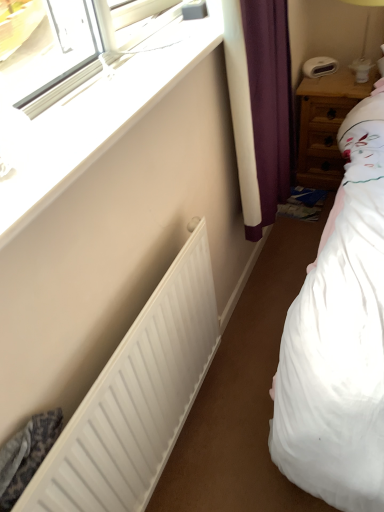
The height and width of the screenshot is (512, 384). Find the location of `white plastic bedside lamp at upper right`. white plastic bedside lamp at upper right is located at coordinates (363, 42).

Image resolution: width=384 pixels, height=512 pixels. Find the location of `white plastic window at upper left`. white plastic window at upper left is located at coordinates (96, 123).

Does white matte radiator at lower left have a larger size compared to white plastic window at upper left?

Yes.

From a real-world perspective, which is physically above, white matte radiator at lower left or white plastic window at upper left?

In real-world perspective, white plastic window at upper left is above.

Is white matte radiator at lower left completely or partially outside of white plastic window at upper left?

That's correct, white matte radiator at lower left is outside of white plastic window at upper left.

Is white matte radiator at lower left positioned far away from white plastic window at upper left?

white matte radiator at lower left is actually quite close to white plastic window at upper left.

Which object is positioned more to the right, wooden nightstand at right or white plastic window at upper left?

wooden nightstand at right.

Between wooden nightstand at right and white plastic window at upper left, which one is positioned in front?

white plastic window at upper left is closer to the camera.

Is wooden nightstand at right directly adjacent to white plastic window at upper left?

No, wooden nightstand at right is not next to white plastic window at upper left.

From a real-world perspective, is wooden nightstand at right positioned over white plastic window at upper left based on gravity?

Incorrect, from a real-world perspective, wooden nightstand at right is lower than white plastic window at upper left.

Based on the photo, from a real-world perspective, between wooden nightstand at right and white matte radiator at lower left, who is vertically lower?

From a 3D spatial view, wooden nightstand at right is below.

In the scene shown: How different are the orientations of wooden nightstand at right and white matte radiator at lower left in degrees?

The angle between the facing direction of wooden nightstand at right and the facing direction of white matte radiator at lower left is 90.3 degrees.

Is wooden nightstand at right turned away from white matte radiator at lower left?

wooden nightstand at right does not have its back to white matte radiator at lower left.

You are a GUI agent. You are given a task and a screenshot of the screen. Output one action in this format:
    pyautogui.click(x=<x>, y=<y>)
    Task: Click on the bedside lamp in front of the wooden nightstand at right
    This screenshot has height=512, width=384.
    Given the screenshot: What is the action you would take?
    pyautogui.click(x=363, y=42)

Is wooden nightstand at right next to white plastic bedside lamp at upper right?

wooden nightstand at right and white plastic bedside lamp at upper right are clearly separated.

Considering the relative sizes of wooden nightstand at right and white plastic bedside lamp at upper right in the image provided, is wooden nightstand at right bigger than white plastic bedside lamp at upper right?

Correct, wooden nightstand at right is larger in size than white plastic bedside lamp at upper right.

Looking at this image, are white plastic window at upper left and wooden nightstand at right located far from each other?

Yes, white plastic window at upper left and wooden nightstand at right are located far from each other.

In terms of width, does white plastic window at upper left look wider or thinner when compared to wooden nightstand at right?

In the image, white plastic window at upper left appears to be more narrow than wooden nightstand at right.

Between white plastic window at upper left and wooden nightstand at right, which one appears on the left side from the viewer's perspective?

white plastic window at upper left.

Find the location of a particular element. The height and width of the screenshot is (512, 384). window on the left of wooden nightstand at right is located at coordinates (96, 123).

Considering the sizes of objects white plastic bedside lamp at upper right and white plastic window at upper left in the image provided, who is taller, white plastic bedside lamp at upper right or white plastic window at upper left?

Standing taller between the two is white plastic bedside lamp at upper right.

Are white plastic bedside lamp at upper right and white plastic window at upper left located far from each other?

white plastic bedside lamp at upper right is positioned a significant distance from white plastic window at upper left.

In the image, is white plastic bedside lamp at upper right on the left side or the right side of white plastic window at upper left?

Clearly, white plastic bedside lamp at upper right is on the right of white plastic window at upper left in the image.

Where is `bedside lamp that appears behind the white plastic window at upper left`? The width and height of the screenshot is (384, 512). bedside lamp that appears behind the white plastic window at upper left is located at coordinates (363, 42).

Is white plastic window at upper left positioned far away from white matte radiator at lower left?

Actually, white plastic window at upper left and white matte radiator at lower left are a little close together.

From a real-world perspective, is white plastic window at upper left positioned over white matte radiator at lower left based on gravity?

Yes, from a real-world perspective, white plastic window at upper left is above white matte radiator at lower left.

Is white plastic window at upper left bigger than white matte radiator at lower left?

No.

Is white plastic window at upper left inside or outside of white matte radiator at lower left?

white plastic window at upper left is located beyond the bounds of white matte radiator at lower left.

The width and height of the screenshot is (384, 512). Find the location of `radiator below the white plastic window at upper left (from a real-world perspective)`. radiator below the white plastic window at upper left (from a real-world perspective) is located at coordinates (136, 398).

Identify the location of window above the wooden nightstand at right (from a real-world perspective). (96, 123).

Which object lies further to the anchor point white plastic bedside lamp at upper right, white matte radiator at lower left or white plastic window at upper left?

white matte radiator at lower left.

Which object lies further to the anchor point wooden nightstand at right, white plastic window at upper left or white plastic bedside lamp at upper right?

Based on the image, white plastic window at upper left appears to be further to wooden nightstand at right.

Consider the image. Which object lies nearer to the anchor point white matte radiator at lower left, wooden nightstand at right or white plastic bedside lamp at upper right?

wooden nightstand at right.

In the scene shown: Which object lies nearer to the anchor point white plastic bedside lamp at upper right, white plastic window at upper left or wooden nightstand at right?

The object closer to white plastic bedside lamp at upper right is wooden nightstand at right.

Looking at the image, which one is located closer to white matte radiator at lower left, white plastic bedside lamp at upper right or wooden nightstand at right?

wooden nightstand at right is positioned closer to the anchor white matte radiator at lower left.

Considering their positions, is white plastic bedside lamp at upper right positioned closer to white matte radiator at lower left than white plastic window at upper left?

white plastic window at upper left is closer to white matte radiator at lower left.

From the image, which object appears to be farther from white plastic window at upper left, white matte radiator at lower left or white plastic bedside lamp at upper right?

Based on the image, white plastic bedside lamp at upper right appears to be further to white plastic window at upper left.

Looking at the image, which one is located closer to wooden nightstand at right, white plastic window at upper left or white matte radiator at lower left?

Based on the image, white plastic window at upper left appears to be nearer to wooden nightstand at right.

Locate an element on the screen. The width and height of the screenshot is (384, 512). bedside lamp located between white plastic window at upper left and wooden nightstand at right in the depth direction is located at coordinates (363, 42).

The image size is (384, 512). In order to click on nightstand between white plastic bedside lamp at upper right and white matte radiator at lower left in the vertical direction in this screenshot , I will do `click(326, 125)`.

Where is `radiator between white plastic window at upper left and wooden nightstand at right in the front-back direction`? radiator between white plastic window at upper left and wooden nightstand at right in the front-back direction is located at coordinates (136, 398).

You are a GUI agent. You are given a task and a screenshot of the screen. Output one action in this format:
    pyautogui.click(x=<x>, y=<y>)
    Task: Click on the window between white plastic bedside lamp at upper right and white matte radiator at lower left from top to bottom
    The height and width of the screenshot is (512, 384).
    Given the screenshot: What is the action you would take?
    pyautogui.click(x=96, y=123)